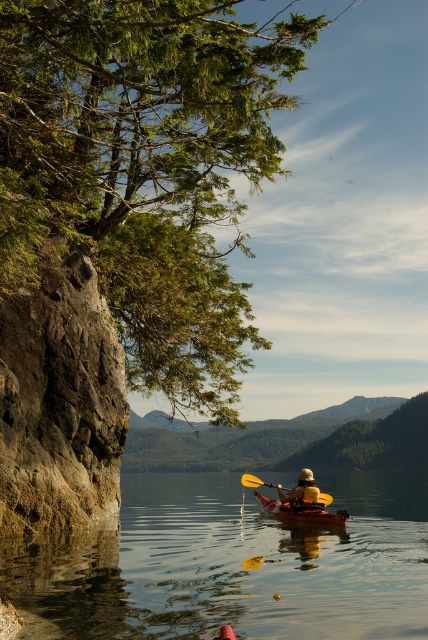
Looking at this image, which is above, yellow foam kayak at center or yellow plastic paddle at center?

yellow foam kayak at center

Does point (302, 483) lie in front of point (244, 474)?

Yes.

Where is `yellow foam kayak at center`? The width and height of the screenshot is (428, 640). yellow foam kayak at center is located at coordinates (302, 488).

Does orange plastic kayak at center come behind yellow plastic paddle at center?

No, it is not.

Which of these two, orange plastic kayak at center or yellow plastic paddle at center, stands taller?

With more height is yellow plastic paddle at center.

Is point (300, 515) closer to camera compared to point (255, 481)?

Yes, point (300, 515) is in front of point (255, 481).

Find the location of a particular element. The image size is (428, 640). orange plastic kayak at center is located at coordinates (300, 512).

In the scene shown: Does orange plastic kayak at center have a greater width compared to yellow foam kayak at center?

Correct, the width of orange plastic kayak at center exceeds that of yellow foam kayak at center.

Who is more distant from viewer, (288,506) or (317,500)?

Point (288,506)

The image size is (428, 640). I want to click on orange plastic kayak at center, so click(x=300, y=512).